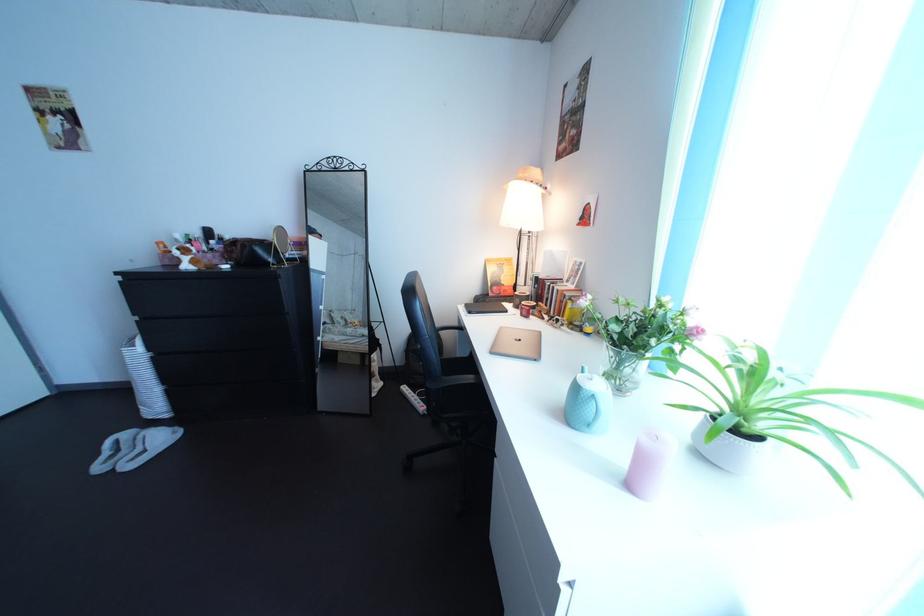
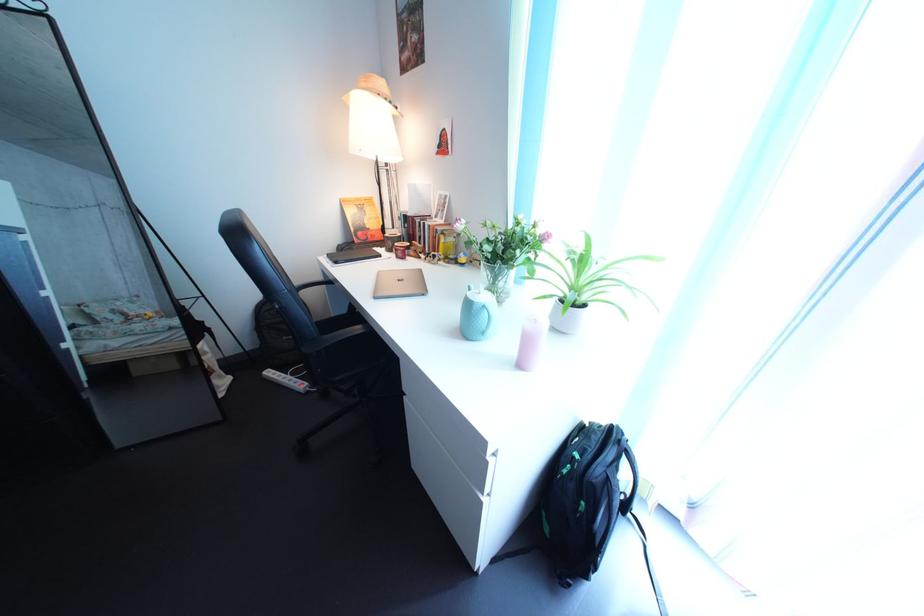
In the second image, find the point that corresponds to the point at 419,397 in the first image.

(284, 381)